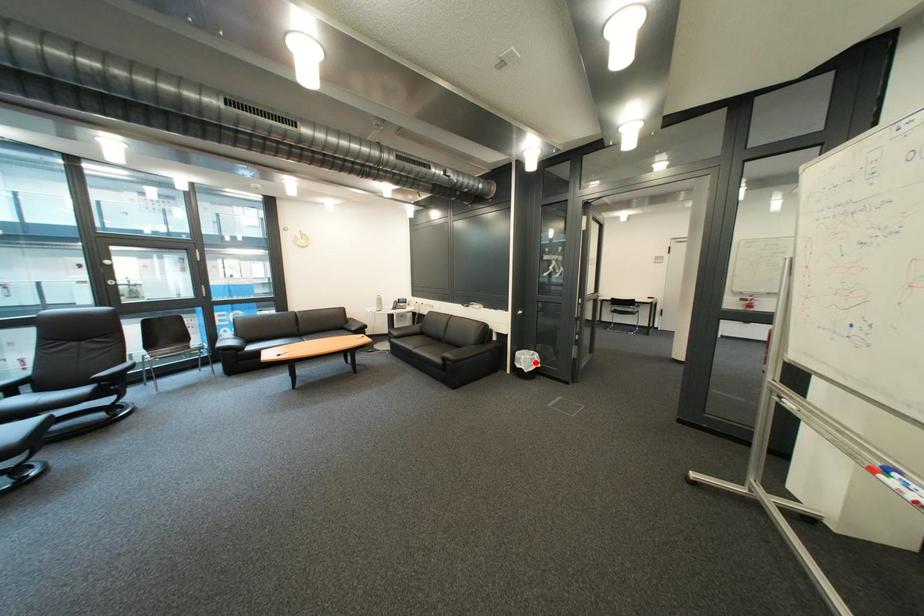
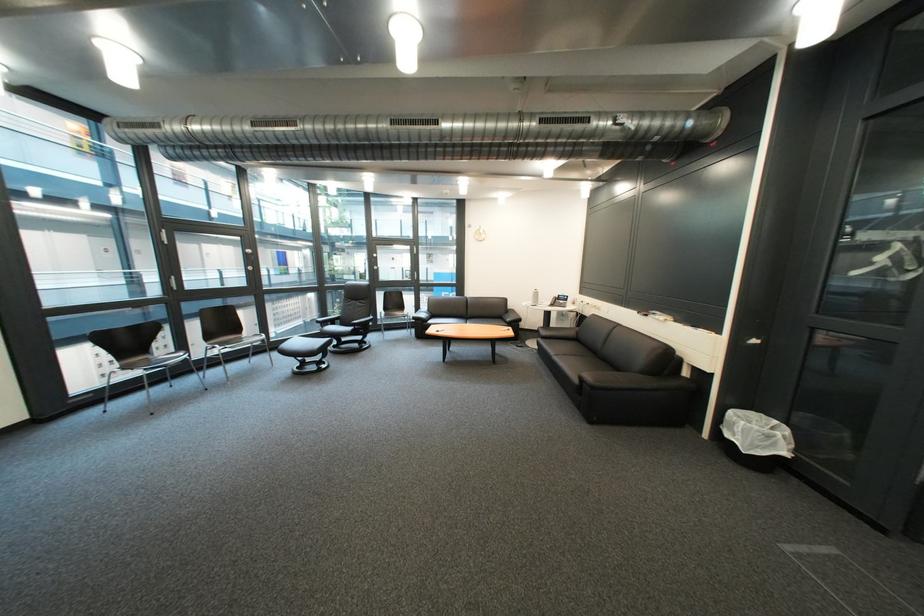
The point at the highlighted location is marked in the first image. Where is the corresponding point in the second image?

(751, 431)